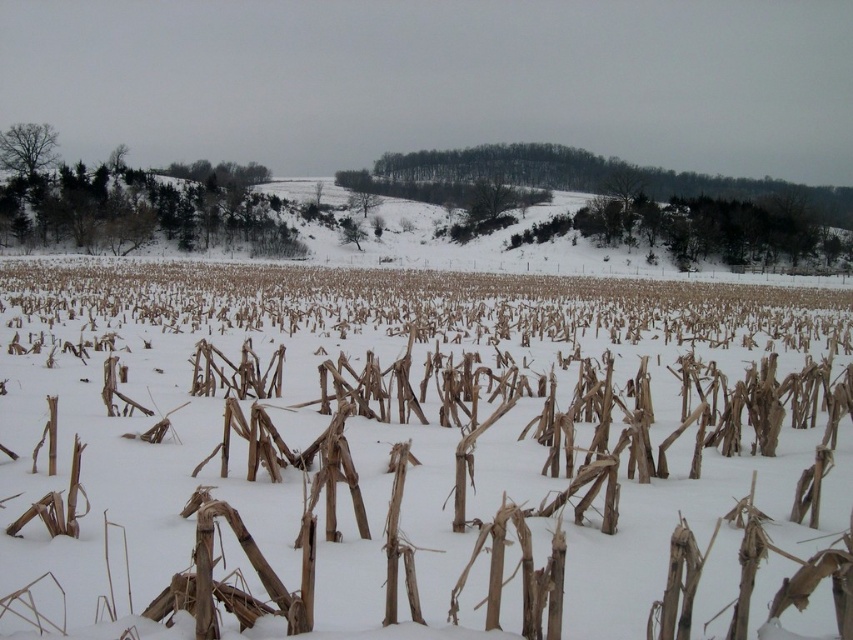
Question: Is green leafy trees at left bigger than bare branches at upper left?

Choices:
 (A) no
 (B) yes

Answer: (B)

Question: Among these objects, which one is farthest from the camera?

Choices:
 (A) brown dry stalks at center
 (B) bare branches at upper left

Answer: (B)

Question: Does brown dry stalks at center have a larger size compared to bare branches at upper left?

Choices:
 (A) no
 (B) yes

Answer: (B)

Question: Which object appears closest to the camera in this image?

Choices:
 (A) brown dry stalks at center
 (B) bare branches at upper left

Answer: (A)

Question: Can you confirm if brown dry stalks at center is positioned to the left of bare branches at upper left?

Choices:
 (A) yes
 (B) no

Answer: (B)

Question: Which of the following is the closest to the observer?

Choices:
 (A) brown dry stalks at center
 (B) green leafy trees at left

Answer: (A)